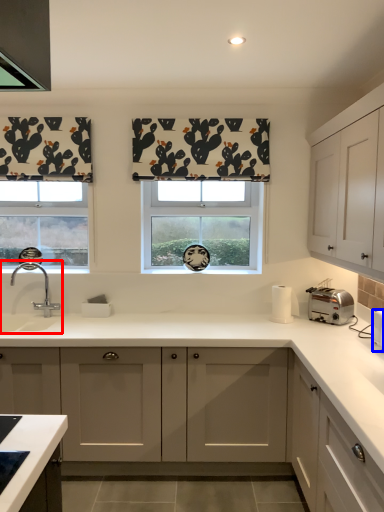
Question: Which object appears farthest to the camera in this image, sink (highlighted by a red box) or appliance (highlighted by a blue box)?

Choices:
 (A) sink
 (B) appliance

Answer: (A)